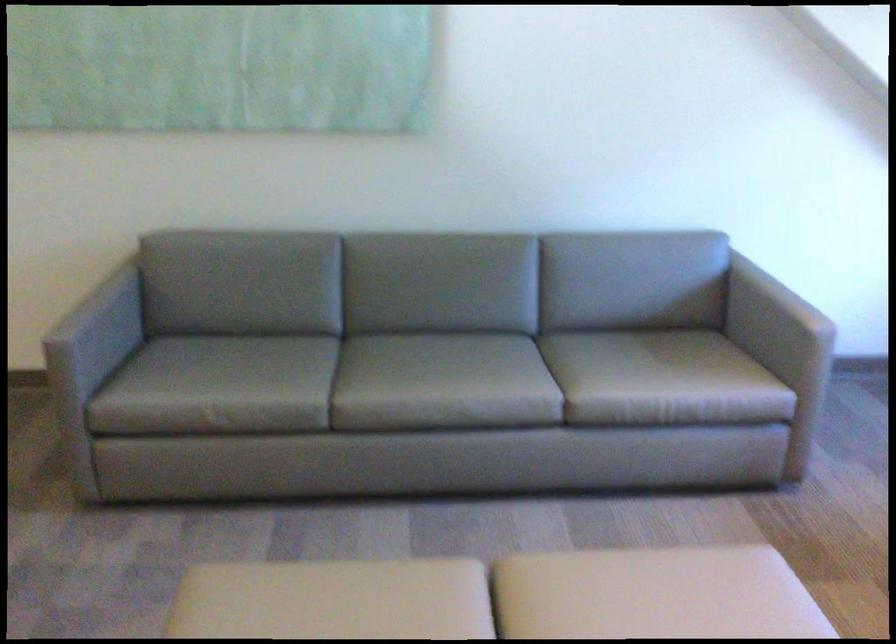
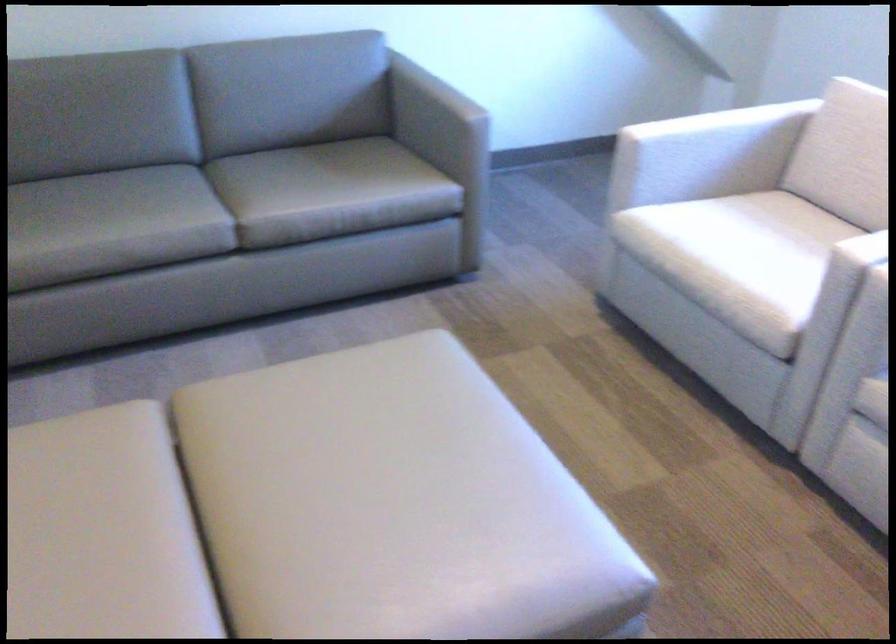
Question: Which direction would the cameraman need to move to produce the second image? Reply with the corresponding letter.

Choices:
 (A) Left
 (B) Right
 (C) Forward
 (D) Backward

Answer: (B)